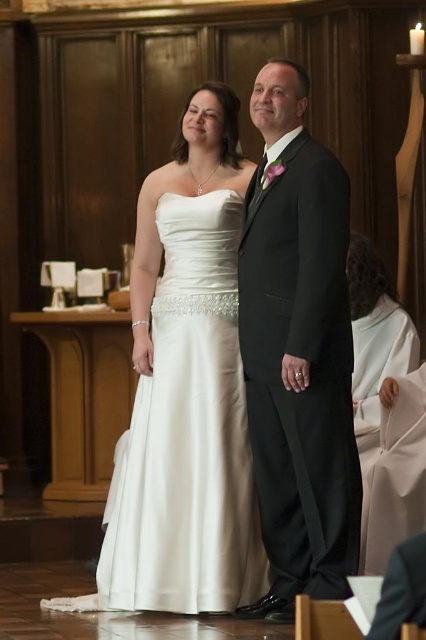
From the picture: You are a photographer at the wedding and want to capture the couple in a way that highlights both the white satin dress at center and the black satin suit at center. Since the dress is covering part of the suit, how can you adjust your angle to ensure both outfits are fully visible?

The white satin dress at center is positioned over black satin suit at center. To ensure both outfits are fully visible, the photographer should adjust the angle to capture the couple from a side view where the dress and suit are not overlapping.

You are a photographer at the wedding and need to position a bouquet in such a way that it is between the white satin dress at center and the black satin suit at center. According to the scene description, where should you place the bouquet relative to the couple?

The bouquet should be placed to the right of the white satin dress at center and to the left of the black satin suit at center, as the white satin dress at center is positioned to the left of the black satin suit at center.